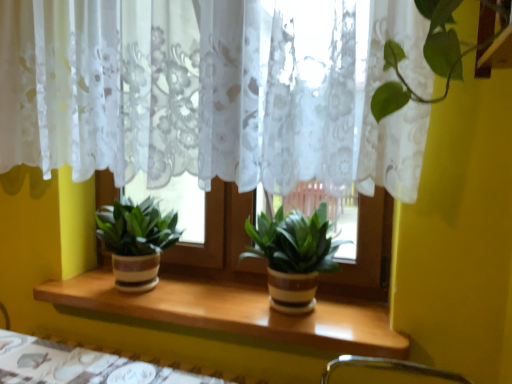
Question: Is wooden table at lower center to the left of green matte plant at center, the 2th houseplant viewed from the right, from the viewer's perspective?

Choices:
 (A) yes
 (B) no

Answer: (B)

Question: From a real-world perspective, does wooden table at lower center sit lower than green matte plant at center, the 2th houseplant viewed from the right?

Choices:
 (A) no
 (B) yes

Answer: (B)

Question: Does wooden table at lower center have a lesser height compared to green matte plant at center, which is counted as the first houseplant, starting from the left?

Choices:
 (A) yes
 (B) no

Answer: (A)

Question: Is wooden table at lower center oriented towards green matte plant at center, the 2th houseplant viewed from the right?

Choices:
 (A) yes
 (B) no

Answer: (B)

Question: Is wooden table at lower center next to green matte plant at center, the 2th houseplant viewed from the right?

Choices:
 (A) yes
 (B) no

Answer: (B)

Question: From the image's perspective, does wooden table at lower center appear higher than green matte plant at center, the 2th houseplant viewed from the right?

Choices:
 (A) yes
 (B) no

Answer: (B)

Question: Is white lace curtain at center closer to camera compared to green matte plant at center, which is counted as the first houseplant, starting from the left?

Choices:
 (A) no
 (B) yes

Answer: (B)

Question: Considering the relative sizes of white lace curtain at center and green matte plant at center, which is counted as the first houseplant, starting from the left, in the image provided, is white lace curtain at center smaller than green matte plant at center, which is counted as the first houseplant, starting from the left,?

Choices:
 (A) no
 (B) yes

Answer: (A)

Question: Is green matte plant at center, the 2th houseplant viewed from the right, inside white lace curtain at center?

Choices:
 (A) yes
 (B) no

Answer: (B)

Question: From a real-world perspective, is white lace curtain at center on green matte plant at center, which is counted as the first houseplant, starting from the left?

Choices:
 (A) yes
 (B) no

Answer: (A)

Question: From the image's perspective, is white lace curtain at center above green matte plant at center, the 2th houseplant viewed from the right?

Choices:
 (A) yes
 (B) no

Answer: (A)

Question: From a real-world perspective, is white lace curtain at center below green matte plant at center, the 2th houseplant viewed from the right?

Choices:
 (A) yes
 (B) no

Answer: (B)

Question: Is green matte plant at center, which is the 2th houseplant in left-to-right order, to the right of white lace curtain at center from the viewer's perspective?

Choices:
 (A) no
 (B) yes

Answer: (B)